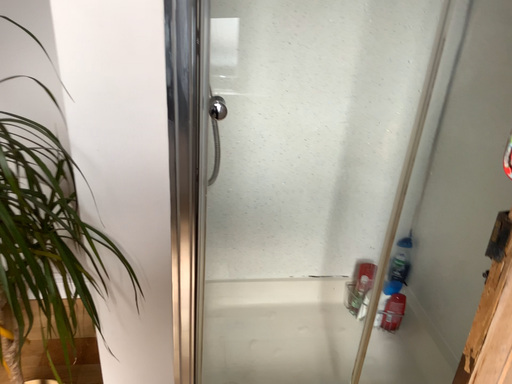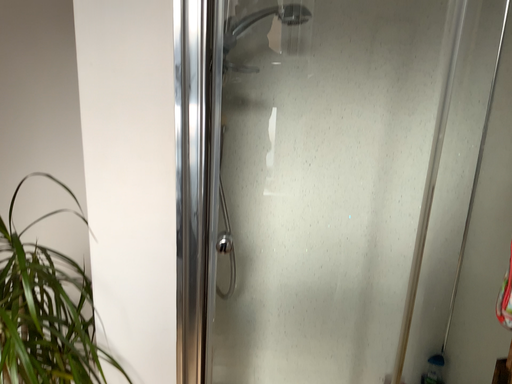
Question: How did the camera likely rotate when shooting the video?

Choices:
 (A) rotated upward
 (B) rotated downward

Answer: (A)